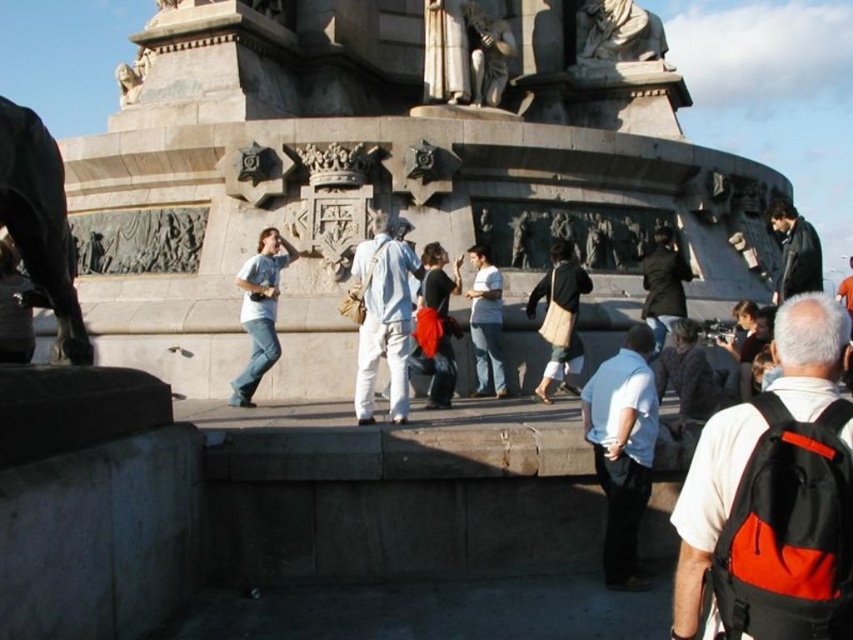
You are a photographer trying to capture the white marble statue at upper center in your shot. However, there is a person wearing a white matte shirt at center blocking your view. Based on their sizes, can you estimate if the person is closer to you or farther away than the statue?

The white matte shirt at center is larger in size compared to the white marble statue at upper center. Since the person appears larger, they are likely closer to you than the statue.

You are standing at the monument and want to take a photo of both the matte black jacket at center and the black leather jacket at upper right. The camera you have can focus on objects up to 25 meters away. Will both jackets be in focus if you take the photo from your current position?

The matte black jacket at center is 24.17 meters away from the black leather jacket at upper right. Since the maximum focus distance of the camera is 25 meters, both jackets will be within the focus range and thus in focus.